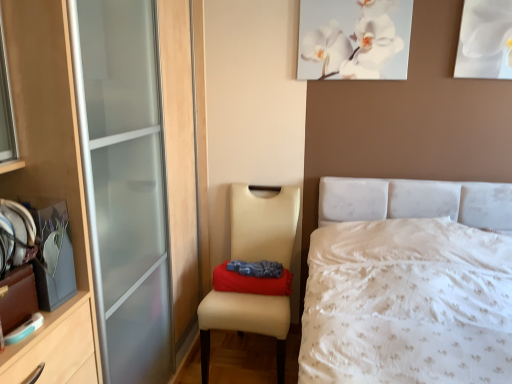
In order to face red fabric pillow at center, should I rotate leftwards or rightwards?

Rotate your view left by about 0.102°.

Locate an element on the screen. white paper at upper right, positioned as the first picture frame in right-to-left order is located at coordinates (485, 40).

What do you see at coordinates (485, 40) in the screenshot? I see `white paper at upper right, positioned as the first picture frame in right-to-left order` at bounding box center [485, 40].

Where is `white canvas at upper center, acting as the first picture frame starting from the left`? The width and height of the screenshot is (512, 384). white canvas at upper center, acting as the first picture frame starting from the left is located at coordinates (354, 39).

Locate an element on the screen. The height and width of the screenshot is (384, 512). white textured bed at center is located at coordinates (408, 285).

Is white textured bed at center taller than beige leather chair at lower left?

Yes, white textured bed at center is taller than beige leather chair at lower left.

Considering the sizes of objects white textured bed at center and beige leather chair at lower left in the image provided, who is wider, white textured bed at center or beige leather chair at lower left?

white textured bed at center.

Is point (404, 221) closer or farther from the camera than point (254, 305)?

Point (404, 221) is farther from the camera than point (254, 305).

Can you confirm if white textured bed at center is bigger than beige leather chair at lower left?

Correct, white textured bed at center is larger in size than beige leather chair at lower left.

Is the surface of beige leather chair at lower left in direct contact with red fabric pillow at center?

No, beige leather chair at lower left is not next to red fabric pillow at center.

In the scene shown: Which is more to the left, beige leather chair at lower left or red fabric pillow at center?

beige leather chair at lower left.

Locate an element on the screen. This screenshot has width=512, height=384. chair below the red fabric pillow at center (from a real-world perspective) is located at coordinates (263, 224).

From the image's perspective, is beige leather chair at lower left under red fabric pillow at center?

Yes, from the image's perspective, beige leather chair at lower left is beneath red fabric pillow at center.

Considering the sizes of objects white canvas at upper center, which is the 2th picture frame from right to left, and white textured bed at center in the image provided, who is wider, white canvas at upper center, which is the 2th picture frame from right to left, or white textured bed at center?

white textured bed at center is wider.

Can you tell me how much white canvas at upper center, acting as the first picture frame starting from the left, and white textured bed at center differ in facing direction?

They differ by 0.548 degrees in their facing directions.

Considering the points (336, 45) and (467, 306), which point is in front, point (336, 45) or point (467, 306)?

The point (467, 306) is closer to the camera.

From the image's perspective, which is above, white textured bed at center or white canvas at upper center, acting as the first picture frame starting from the left?

white canvas at upper center, acting as the first picture frame starting from the left, from the image's perspective.

Is white textured bed at center at the left side of white canvas at upper center, acting as the first picture frame starting from the left?

In fact, white textured bed at center is to the right of white canvas at upper center, acting as the first picture frame starting from the left.

Which object is closer to the camera taking this photo, white textured bed at center or white canvas at upper center, acting as the first picture frame starting from the left?

Answer: white textured bed at center is more forward.

Which point is more distant from viewer, (316, 326) or (367, 59)?

Positioned behind is point (367, 59).

Is white paper at upper right, which appears as the second picture frame when viewed from the left, taller than white textured bed at center?

In fact, white paper at upper right, which appears as the second picture frame when viewed from the left, may be shorter than white textured bed at center.

Identify the location of bed that appears on the left of white paper at upper right, which appears as the second picture frame when viewed from the left. point(408,285).

Is point (493, 46) closer to camera compared to point (310, 377)?

No.

Between white paper at upper right, which appears as the second picture frame when viewed from the left, and white textured bed at center, which one appears on the right side from the viewer's perspective?

white paper at upper right, which appears as the second picture frame when viewed from the left, is more to the right.

Which of these two, white paper at upper right, positioned as the first picture frame in right-to-left order, or beige leather chair at lower left, stands shorter?

Standing shorter between the two is white paper at upper right, positioned as the first picture frame in right-to-left order.

Can you confirm if white paper at upper right, positioned as the first picture frame in right-to-left order, is smaller than beige leather chair at lower left?

Indeed, white paper at upper right, positioned as the first picture frame in right-to-left order, has a smaller size compared to beige leather chair at lower left.

Between point (493, 23) and point (265, 297), which one is positioned behind?

The point (265, 297) is behind.

Considering the relative sizes of white paper at upper right, positioned as the first picture frame in right-to-left order, and beige leather chair at lower left in the image provided, is white paper at upper right, positioned as the first picture frame in right-to-left order, wider than beige leather chair at lower left?

No.

I want to click on the 1st picture frame to the right when counting from the beige leather chair at lower left, so click(x=354, y=39).

Does point (320, 57) appear closer or farther from the camera than point (277, 215)?

Point (320, 57) is positioned closer to the camera compared to point (277, 215).

Can you confirm if white canvas at upper center, which is the 2th picture frame from right to left, is taller than beige leather chair at lower left?

Incorrect, the height of white canvas at upper center, which is the 2th picture frame from right to left, is not larger of that of beige leather chair at lower left.

You are a GUI agent. You are given a task and a screenshot of the screen. Output one action in this format:
    pyautogui.click(x=<x>, y=<y>)
    Task: Click on the bed above the beige leather chair at lower left (from a real-world perspective)
    The height and width of the screenshot is (384, 512).
    Given the screenshot: What is the action you would take?
    pyautogui.click(x=408, y=285)

Locate an element on the screen. This screenshot has width=512, height=384. chair located below the red fabric pillow at center (from the image's perspective) is located at coordinates (263, 224).

Estimate the real-world distances between objects in this image. Which object is further from red fabric pillow at center, white paper at upper right, which appears as the second picture frame when viewed from the left, or white canvas at upper center, which is the 2th picture frame from right to left?

white paper at upper right, which appears as the second picture frame when viewed from the left.

Based on their spatial positions, is beige leather chair at lower left or white canvas at upper center, which is the 2th picture frame from right to left, closer to red fabric pillow at center?

The object closer to red fabric pillow at center is beige leather chair at lower left.

When comparing their distances from beige leather chair at lower left, does white paper at upper right, which appears as the second picture frame when viewed from the left, or white textured bed at center seem closer?

The object closer to beige leather chair at lower left is white textured bed at center.

Which object lies further to the anchor point red fabric pillow at center, white canvas at upper center, which is the 2th picture frame from right to left, or beige leather chair at lower left?

white canvas at upper center, which is the 2th picture frame from right to left, lies further to red fabric pillow at center than the other object.

Estimate the real-world distances between objects in this image. Which object is further from beige leather chair at lower left, white textured bed at center or white canvas at upper center, which is the 2th picture frame from right to left?

white canvas at upper center, which is the 2th picture frame from right to left, is positioned further to the anchor beige leather chair at lower left.

When comparing their distances from red fabric pillow at center, does white canvas at upper center, which is the 2th picture frame from right to left, or white paper at upper right, which appears as the second picture frame when viewed from the left, seem closer?

white canvas at upper center, which is the 2th picture frame from right to left, is positioned closer to the anchor red fabric pillow at center.

Based on their spatial positions, is white textured bed at center or beige leather chair at lower left closer to white paper at upper right, which appears as the second picture frame when viewed from the left?

The object closer to white paper at upper right, which appears as the second picture frame when viewed from the left, is white textured bed at center.

When comparing their distances from white canvas at upper center, which is the 2th picture frame from right to left, does white paper at upper right, which appears as the second picture frame when viewed from the left, or white textured bed at center seem further?

Among the two, white textured bed at center is located further to white canvas at upper center, which is the 2th picture frame from right to left.

Locate an element on the screen. The image size is (512, 384). picture frame between white textured bed at center and red fabric pillow at center along the z-axis is located at coordinates (485, 40).

Locate an element on the screen. pillow between white paper at upper right, which appears as the second picture frame when viewed from the left, and beige leather chair at lower left, in the vertical direction is located at coordinates (250, 282).

Identify the location of chair between white textured bed at center and red fabric pillow at center along the z-axis. (263, 224).

Locate an element on the screen. The width and height of the screenshot is (512, 384). chair located between white textured bed at center and white paper at upper right, which appears as the second picture frame when viewed from the left, in the depth direction is located at coordinates (263, 224).